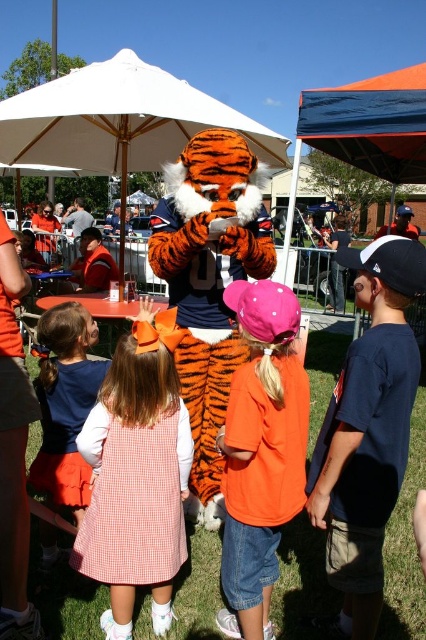
Does point (221, 573) lie behind point (77, 381)?

No, (221, 573) is closer to viewer.

Is orange cotton shirt at center thinner than orange gingham dress at center?

Yes.

Which is in front, point (305, 444) or point (74, 304)?

Positioned in front is point (305, 444).

Where is `orange cotton shirt at center`? The height and width of the screenshot is (640, 426). orange cotton shirt at center is located at coordinates (261, 451).

Does red checkered dress at center have a lesser height compared to blue fabric cap at upper right?

Correct, red checkered dress at center is not as tall as blue fabric cap at upper right.

Is point (147, 572) farther from viewer compared to point (411, 224)?

No, (147, 572) is closer to viewer.

At what (x,y) coordinates should I click in order to perform the action: click on red checkered dress at center. Please return your answer as a coordinate pair (x, y). Looking at the image, I should click on (134, 499).

You are a GUI agent. You are given a task and a screenshot of the screen. Output one action in this format:
    pyautogui.click(x=<x>, y=<y>)
    Task: Click on the orange plush tiger at center
    This screenshot has height=640, width=426.
    Given the screenshot: What is the action you would take?
    pyautogui.click(x=209, y=284)

Which of these two, orange plush tiger at center or red checkered dress at center, stands shorter?

red checkered dress at center

Between point (201, 289) and point (161, 413), which one is positioned behind?

Positioned behind is point (201, 289).

The width and height of the screenshot is (426, 640). Identify the location of orange plush tiger at center. (209, 284).